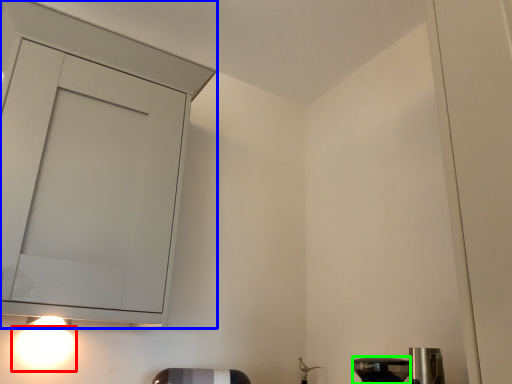
Question: Which object is the closest to the light (highlighted by a red box)? Choose among these: cabinetry (highlighted by a blue box) or appliance (highlighted by a green box).

Choices:
 (A) cabinetry
 (B) appliance

Answer: (A)